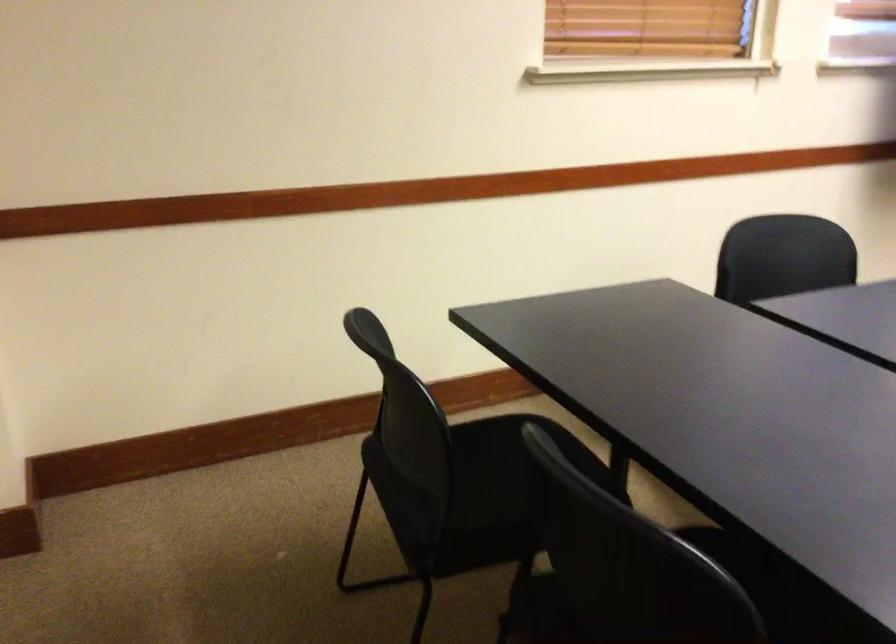
Locate an element on the screen. This screenshot has height=644, width=896. chair sitting surface is located at coordinates (487, 471).